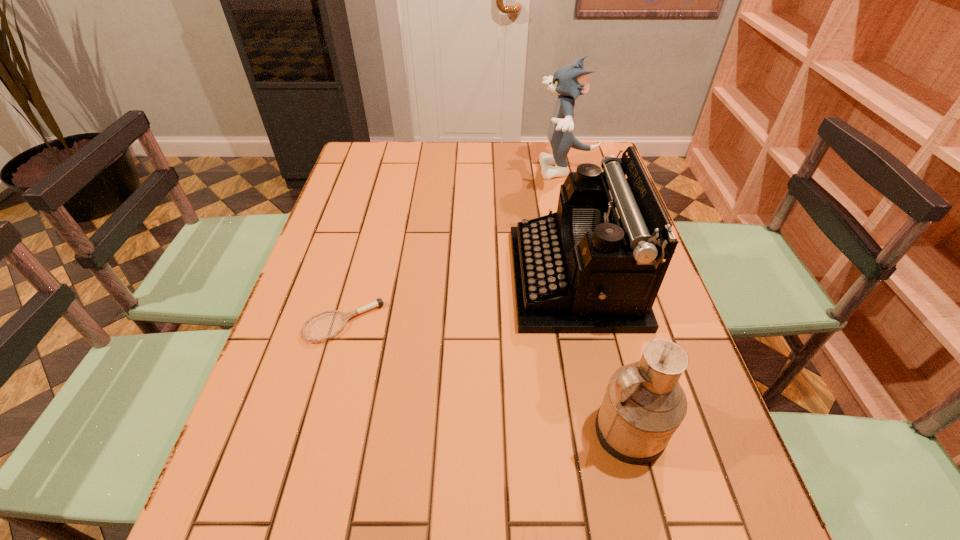
Where is `free spot between the shortest object and the pitcher`? This screenshot has height=540, width=960. free spot between the shortest object and the pitcher is located at coordinates (486, 376).

Locate an element on the screen. Image resolution: width=960 pixels, height=540 pixels. blank region between the tennis racket and the nearest object is located at coordinates (486, 376).

I want to click on free space between the leftmost object and the pitcher, so click(x=486, y=376).

Locate which object is the third closest to the farthest object. Please provide its 2D coordinates. Your answer should be formatted as a tuple, i.e. [(x, y)], where the tuple contains the x and y coordinates of a point satisfying the conditions above.

[(644, 404)]

Choose which object is the second nearest neighbor to the tallest object. Please provide its 2D coordinates. Your answer should be formatted as a tuple, i.e. [(x, y)], where the tuple contains the x and y coordinates of a point satisfying the conditions above.

[(379, 302)]

What are the coordinates of `vacant space that satisfies the following two spatial constraints: 1. on the back side of the nearest object; 2. on the typing side of the typewriter` in the screenshot? It's located at (590, 278).

This screenshot has height=540, width=960. Find the location of `vacant space that satisfies the following two spatial constraints: 1. on the typing side of the typewriter; 2. on the right side of the pitcher`. vacant space that satisfies the following two spatial constraints: 1. on the typing side of the typewriter; 2. on the right side of the pitcher is located at coordinates (608, 430).

Locate an element on the screen. The image size is (960, 540). free spot that satisfies the following two spatial constraints: 1. on the front-facing side of the farthest object; 2. on the front side of the leftmost object is located at coordinates (609, 322).